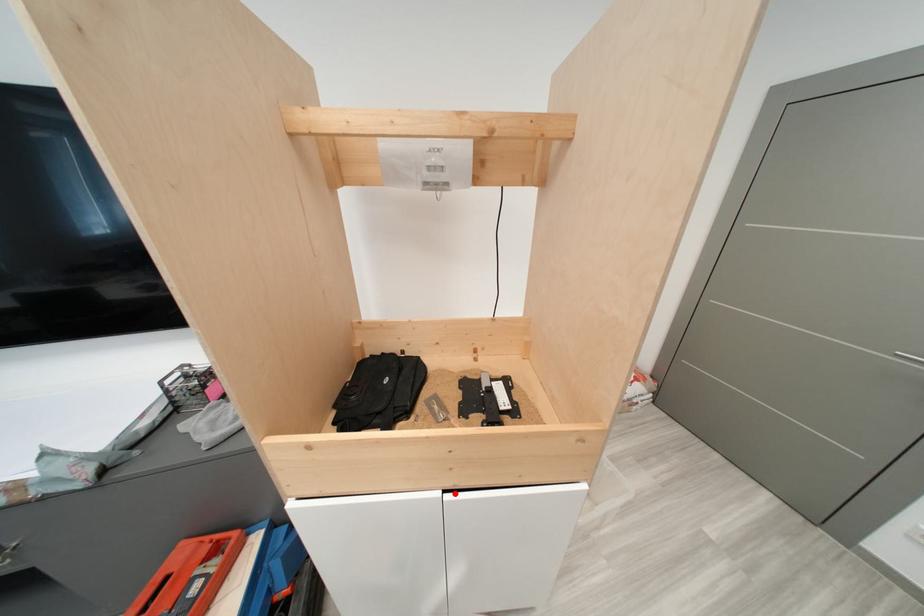
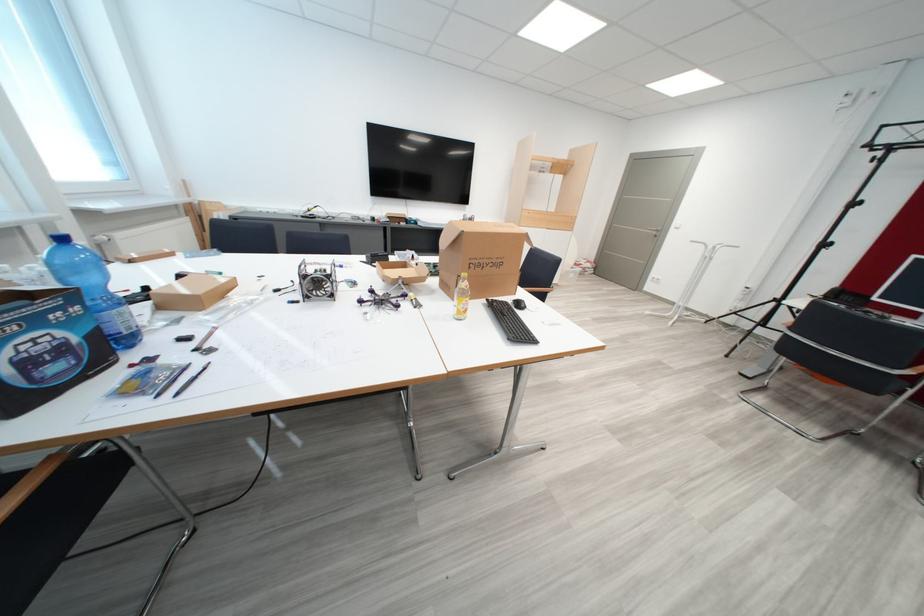
In the second image, find the point that corresponds to the highlighted location in the first image.

(556, 232)